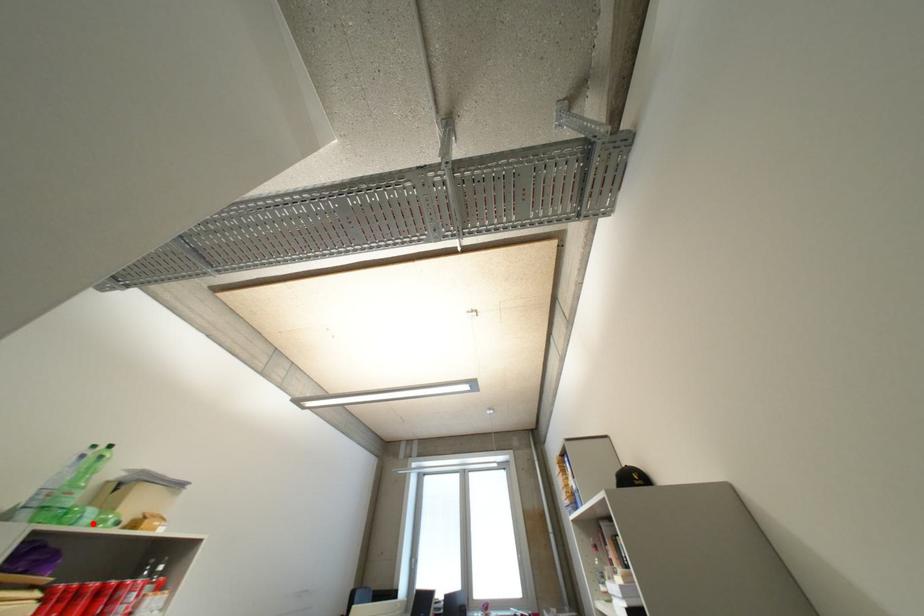
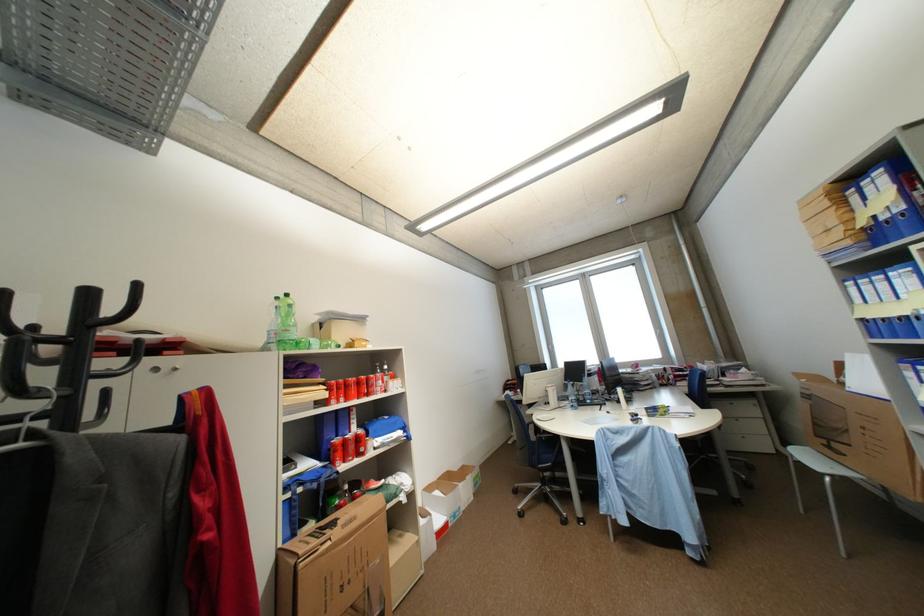
In the second image, find the point that corresponds to the highlighted location in the first image.

(323, 349)